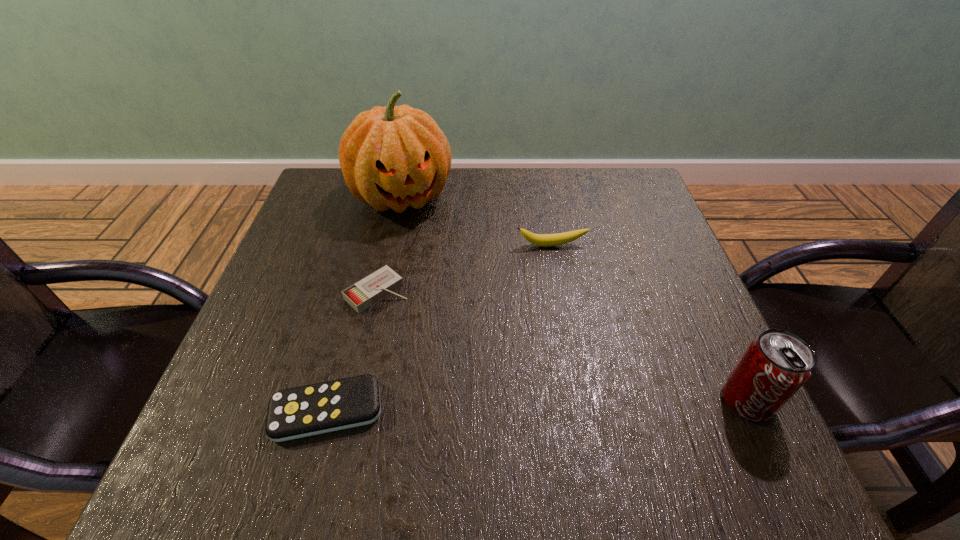
Identify the location of free space located on the back of the rightmost object. This screenshot has height=540, width=960. (697, 295).

Where is `vacant area situated on the carved face of the pumpkin`? vacant area situated on the carved face of the pumpkin is located at coordinates (440, 278).

Locate an element on the screen. The image size is (960, 540). vacant space situated on the carved face of the pumpkin is located at coordinates (458, 318).

At what (x,y) coordinates should I click in order to perform the action: click on vacant space located on the carved face of the pumpkin. Please return your answer as a coordinate pair (x, y). Looking at the image, I should click on (425, 247).

Locate an element on the screen. blank area located on the striking surface of the third farthest object is located at coordinates (484, 384).

This screenshot has width=960, height=540. I want to click on free space located on the striking surface of the third farthest object, so click(443, 348).

You are a GUI agent. You are given a task and a screenshot of the screen. Output one action in this format:
    pyautogui.click(x=<x>, y=<y>)
    Task: Click on the vacant area situated 0.120m on the striking surface of the third farthest object
    
    Given the screenshot: What is the action you would take?
    pyautogui.click(x=435, y=341)

Find the location of `free space located on the upward curve of the banana`. free space located on the upward curve of the banana is located at coordinates (560, 267).

Identify the location of vacant space located 0.300m on the upward curve of the banana. The width and height of the screenshot is (960, 540). (583, 357).

Find the location of a particular element. free spot located on the upward curve of the banana is located at coordinates (565, 290).